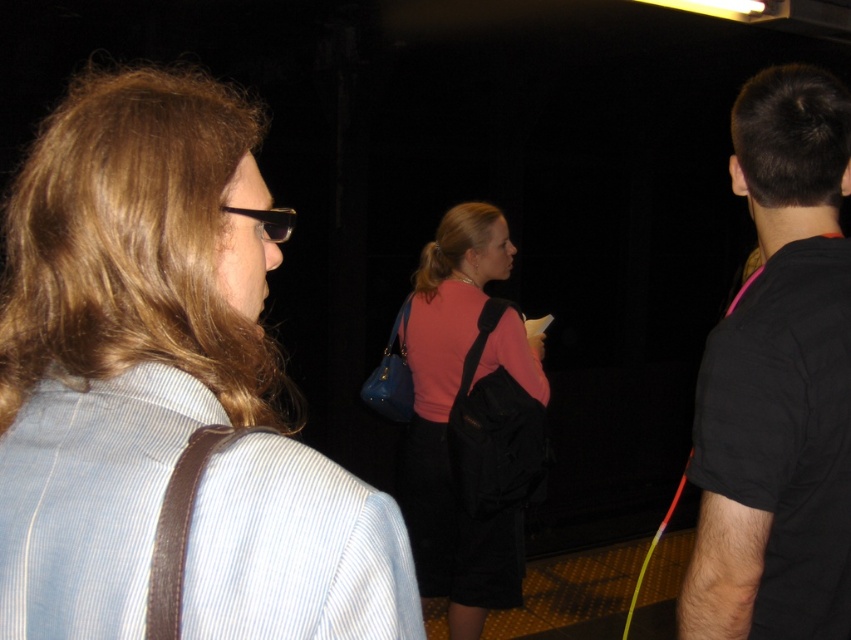
You are standing in the room and want to hand a gift to the person wearing the pink matte sweater at center. Which direction should you move to reach them?

The pink matte sweater at center is located at point (x=449, y=429), so you should move towards the center of the room to reach them.

You are a photographer at a social event. You want to take a photo of the pink matte sweater at center without the black plastic sunglasses at upper left appearing in the frame. Is this possible based on their positions?

The black plastic sunglasses at upper left is behind the pink matte sweater at center, so it should not be visible in the frame if you focus on the pink matte sweater at center.